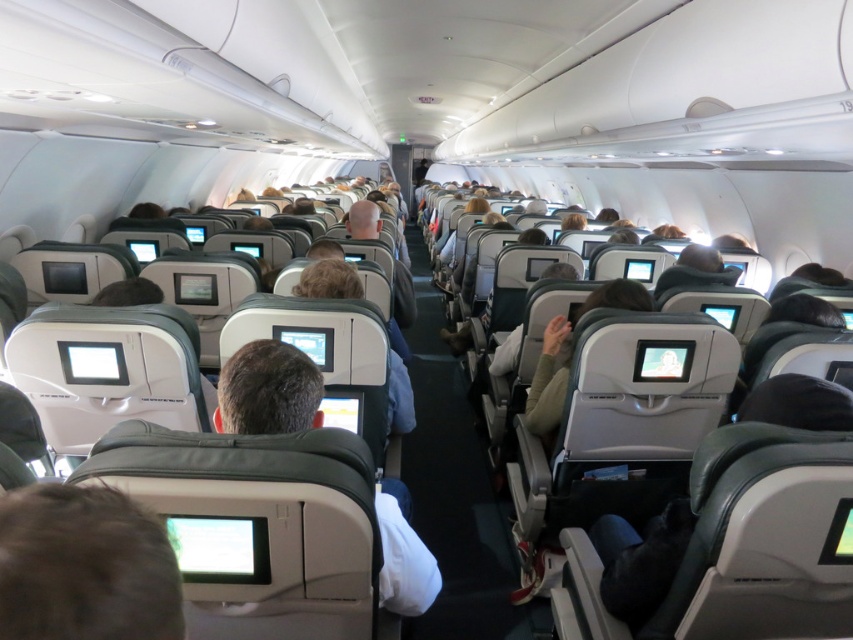
Question: Does dark brown hair at lower left have a larger size compared to matte gray seat at center?

Choices:
 (A) no
 (B) yes

Answer: (A)

Question: Does dark brown hair at lower left appear under matte gray seat at center?

Choices:
 (A) no
 (B) yes

Answer: (A)

Question: Which point is closer to the camera?

Choices:
 (A) (115, 513)
 (B) (392, 502)

Answer: (A)

Question: Can you confirm if dark brown hair at lower left is thinner than matte gray seat at center?

Choices:
 (A) no
 (B) yes

Answer: (B)

Question: Which of the following is the farthest from the observer?

Choices:
 (A) (402, 564)
 (B) (107, 609)

Answer: (A)

Question: Which object is farther from the camera taking this photo?

Choices:
 (A) matte gray seat at center
 (B) dark brown hair at lower left

Answer: (A)